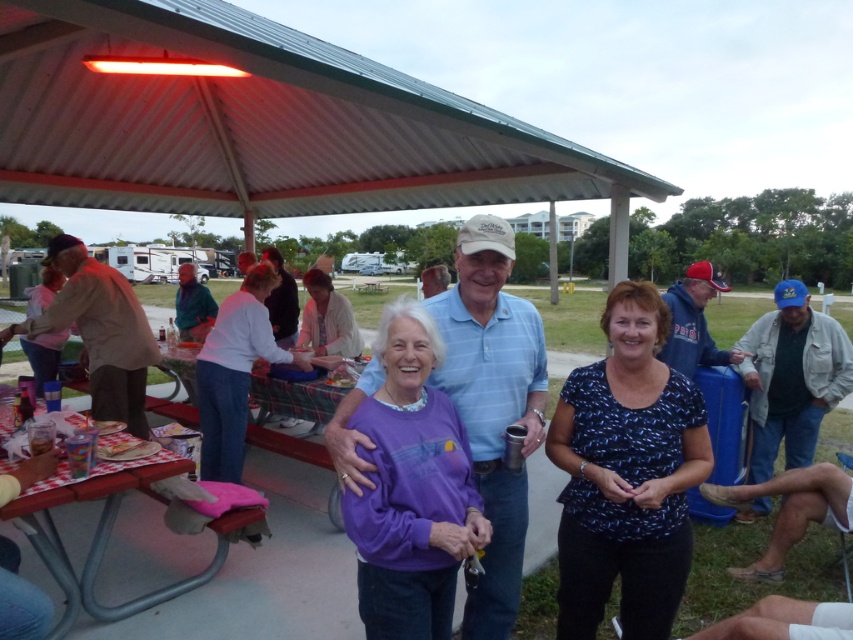
You are at a park pavilion and see a blue printed blouse at center and a red plastic table at lower left. Which object is positioned to the right of the other?

The blue printed blouse at center is positioned to the right of the red plastic table at lower left.

You are attending an evening gathering at a park pavilion. You notice a blue printed blouse at center and a red plastic table at lower left. Which object is located higher in the image?

The blue printed blouse at center is positioned over the red plastic table at lower left, so it is higher in the image.

You are standing at the entrance of the pavilion and see the purple fleece at center. If you walk straight ahead from the entrance, will you step on the purple fleece before reaching the grassy area?

The purple fleece at center is located at point (410,490), which is between the pavilion entrance and the grassy area. Therefore, walking straight ahead from the entrance, you would step on the purple fleece before reaching the grassy area.